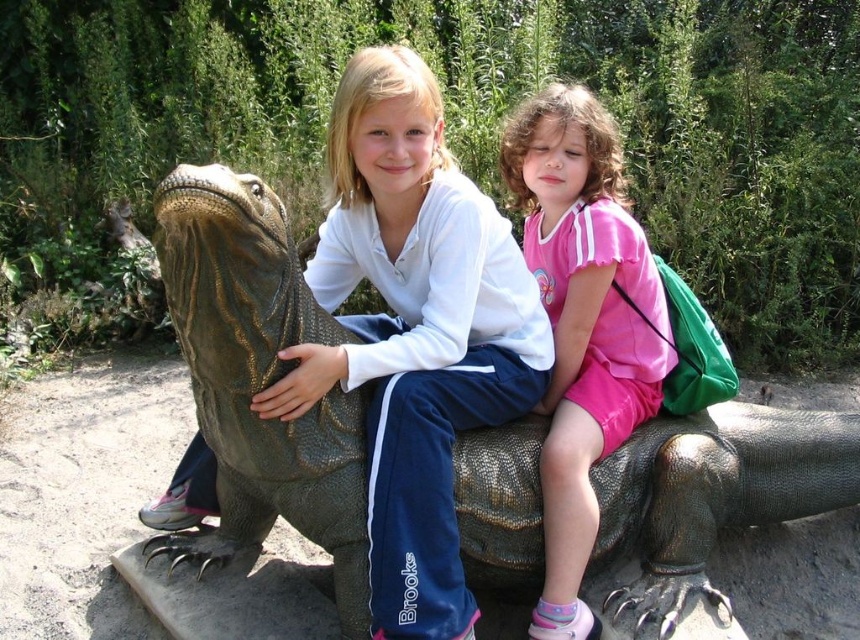
You are a photographer standing in front of the statue. You want to take a photo of the matte green lizard at center and the pink shiny shorts at lower right. How far apart are these two objects in the scene?

The matte green lizard at center is 18.93 inches away from the pink shiny shorts at lower right.

You are a photographer trying to capture the shiny green scales at center in the image. Based on their coordinates, where should you focus your camera lens?

You should focus your camera lens on the coordinates point at (262, 371) to capture the shiny green scales at center.

You are a photographer trying to capture a clear shot of both the shiny green scales at center and the pink shiny shorts at lower right. Since you want both subjects to be in focus, which one should you aim the camera at first?

You should aim the camera at the shiny green scales at center first because it is closer to the viewer than the pink shiny shorts at lower right, ensuring both will be in focus when adjusting the focus accordingly.